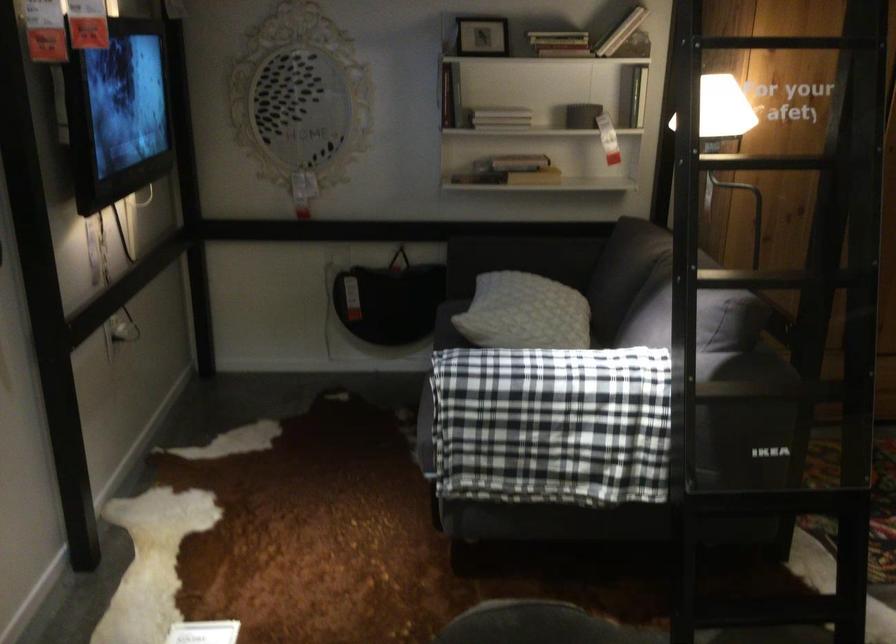
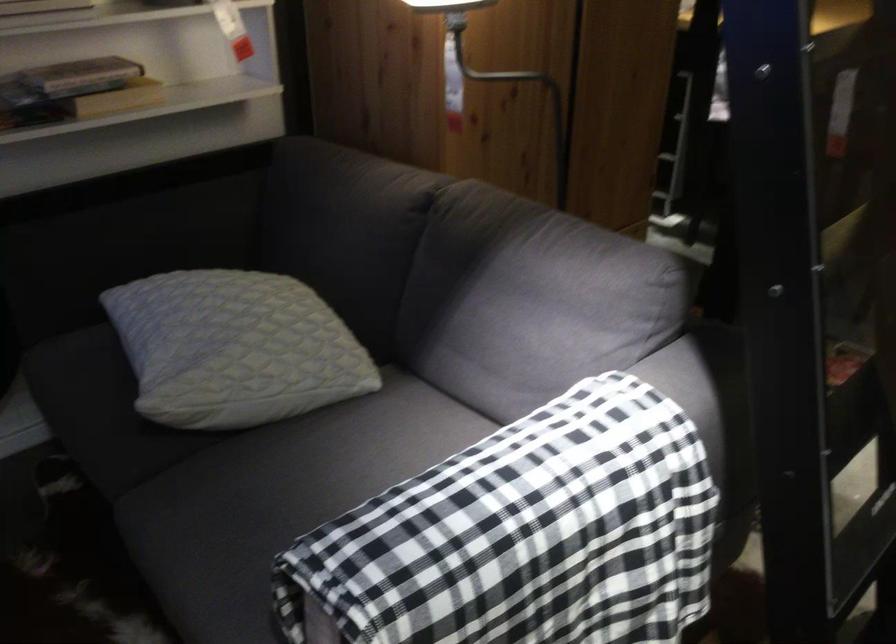
The point at (695, 368) is marked in the first image. Where is the corresponding point in the second image?

(690, 395)